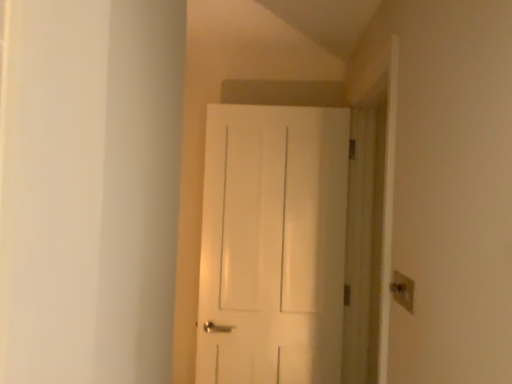
Describe the element at coordinates (273, 245) in the screenshot. This screenshot has height=384, width=512. I see `white matte door at center` at that location.

This screenshot has width=512, height=384. Identify the location of white matte door at center. (273, 245).

Describe the element at coordinates (403, 290) in the screenshot. I see `beige plastic light switch at upper right` at that location.

Where is `beige plastic light switch at upper right`? The height and width of the screenshot is (384, 512). beige plastic light switch at upper right is located at coordinates (403, 290).

Identify the location of white matte door at center. The image size is (512, 384). 273,245.

Which is more to the right, white matte door at center or beige plastic light switch at upper right?

beige plastic light switch at upper right is more to the right.

Which object is closer to the camera taking this photo, white matte door at center or beige plastic light switch at upper right?

beige plastic light switch at upper right is closer to the camera.

Is point (268, 210) in front of point (409, 310)?

No.

From the image's perspective, would you say white matte door at center is shown under beige plastic light switch at upper right?

No.

From a real-world perspective, which is physically below, white matte door at center or beige plastic light switch at upper right?

In real-world perspective, beige plastic light switch at upper right is lower.

In the scene shown: Which of these two, white matte door at center or beige plastic light switch at upper right, is thinner?

beige plastic light switch at upper right is thinner.

Considering the sizes of objects white matte door at center and beige plastic light switch at upper right in the image provided, who is shorter, white matte door at center or beige plastic light switch at upper right?

beige plastic light switch at upper right is shorter.

Can you confirm if white matte door at center is smaller than beige plastic light switch at upper right?

No, white matte door at center is not smaller than beige plastic light switch at upper right.

Is white matte door at center inside the boundaries of beige plastic light switch at upper right, or outside?

white matte door at center is outside beige plastic light switch at upper right.

Is white matte door at center not near beige plastic light switch at upper right?

Indeed, white matte door at center is not near beige plastic light switch at upper right.

Could you tell me if white matte door at center is facing beige plastic light switch at upper right?

Yes, white matte door at center faces towards beige plastic light switch at upper right.

How different are the orientations of white matte door at center and beige plastic light switch at upper right in degrees?

There is a 97.6-degree angle between the facing directions of white matte door at center and beige plastic light switch at upper right.

In order to click on door above the beige plastic light switch at upper right (from the image's perspective) in this screenshot , I will do `click(273, 245)`.

Between beige plastic light switch at upper right and white matte door at center, which one appears on the right side from the viewer's perspective?

Positioned to the right is beige plastic light switch at upper right.

Considering the positions of objects beige plastic light switch at upper right and white matte door at center in the image provided, who is behind, beige plastic light switch at upper right or white matte door at center?

Positioned behind is white matte door at center.

Which is closer to the camera, (396, 275) or (234, 362)?

The point (396, 275) is in front.

In the scene shown: From the image's perspective, is beige plastic light switch at upper right beneath white matte door at center?

Yes, from the image's perspective, beige plastic light switch at upper right is below white matte door at center.

From a real-world perspective, is beige plastic light switch at upper right positioned under white matte door at center based on gravity?

Yes, from a real-world perspective, beige plastic light switch at upper right is below white matte door at center.

Which of these two, beige plastic light switch at upper right or white matte door at center, is wider?

white matte door at center.

Considering the sizes of beige plastic light switch at upper right and white matte door at center in the image, is beige plastic light switch at upper right taller or shorter than white matte door at center?

Considering their sizes, beige plastic light switch at upper right has less height than white matte door at center.

Does beige plastic light switch at upper right have a smaller size compared to white matte door at center?

Yes.

Is beige plastic light switch at upper right spatially inside white matte door at center, or outside of it?

beige plastic light switch at upper right is not enclosed by white matte door at center.

Is beige plastic light switch at upper right directly adjacent to white matte door at center?

No.

Is beige plastic light switch at upper right oriented away from white matte door at center?

No.

Measure the distance from beige plastic light switch at upper right to white matte door at center.

The distance of beige plastic light switch at upper right from white matte door at center is 3.35 feet.

At what (x,y) coordinates should I click in order to perform the action: click on light switch that appears in front of the white matte door at center. Please return your answer as a coordinate pair (x, y). Image resolution: width=512 pixels, height=384 pixels. Looking at the image, I should click on (403, 290).

Locate an element on the screen. door lying on the left of beige plastic light switch at upper right is located at coordinates (273, 245).

Find the location of `door above the beige plastic light switch at upper right (from the image's perspective)`. door above the beige plastic light switch at upper right (from the image's perspective) is located at coordinates (273, 245).